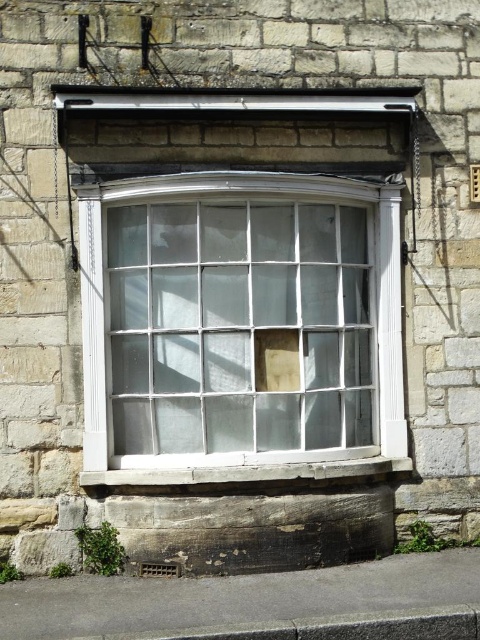
You are a window cleaner standing on the smooth stone window sill at center. You need to clean the clear glass window at center. Can you reach the entire window from your current position?

The clear glass window at center is positioned over the smooth stone window sill at center, so yes, you can reach the entire window from the smooth stone window sill at center since you are directly below it.

You are an architect designing a new building and want to ensure the clear glass window at center and the smooth stone window sill at center are proportionate. Based on the image, which object should you make smaller to maintain balance?

The clear glass window at center is larger than the smooth stone window sill at center. To maintain balance, the architect should make the clear glass window at center smaller or reduce the size of the smooth stone window sill at center to match the proportions.